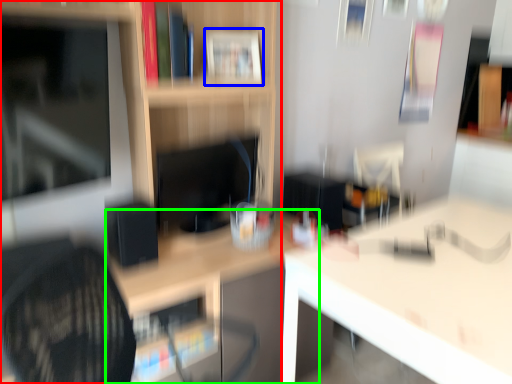
Question: Which is nearer to the shelf (highlighted by a red box)? book (highlighted by a blue box) or table (highlighted by a green box).

Choices:
 (A) book
 (B) table

Answer: (A)